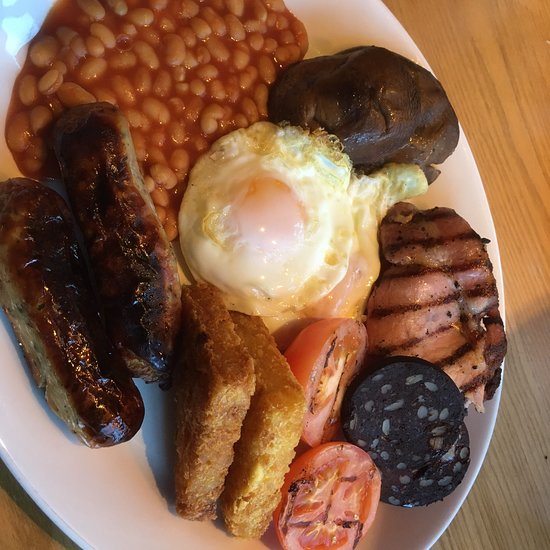
Where is `wood table top`? wood table top is located at coordinates (515, 465).